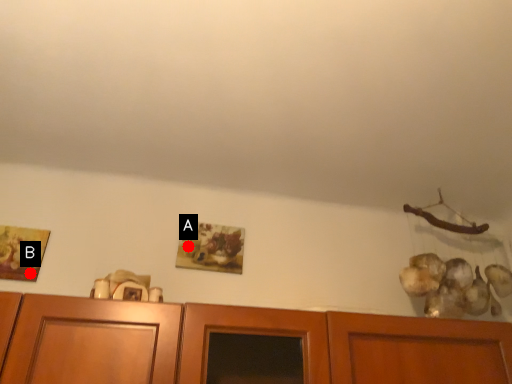
Question: Two points are circled on the image, labeled by A and B beside each circle. Which of the following is the farthest from the observer?

Choices:
 (A) A is further
 (B) B is further

Answer: (A)